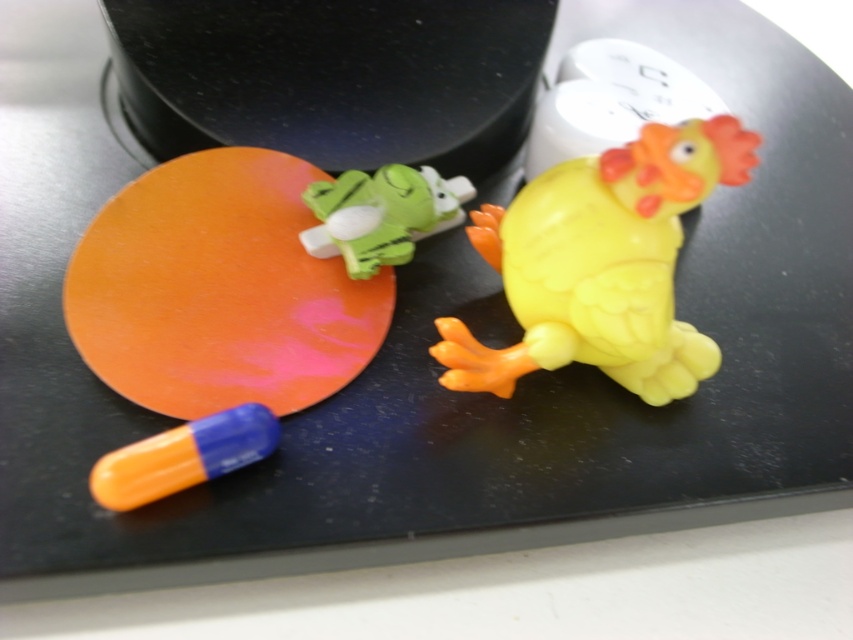
Between yellow rubber chicken at center and green rubber frog at center, which one has less height?

Standing shorter between the two is green rubber frog at center.

Who is lower down, yellow rubber chicken at center or green rubber frog at center?

yellow rubber chicken at center is below.

Between point (639, 368) and point (347, 253), which one is positioned in front?

Point (639, 368)

At what (x,y) coordinates should I click in order to perform the action: click on yellow rubber chicken at center. Please return your answer as a coordinate pair (x, y). Looking at the image, I should click on (601, 262).

Can you confirm if green rubber frog at center is positioned to the left of orange matte pill at lower left?

In fact, green rubber frog at center is to the right of orange matte pill at lower left.

This screenshot has width=853, height=640. Identify the location of green rubber frog at center. (381, 214).

Is point (345, 234) more distant than point (120, 448)?

Yes, point (345, 234) is farther from viewer.

At what (x,y) coordinates should I click in order to perform the action: click on green rubber frog at center. Please return your answer as a coordinate pair (x, y). The image size is (853, 640). Looking at the image, I should click on (381, 214).

Does yellow rubber chicken at center have a greater width compared to orange matte pill at lower left?

Yes.

Between yellow rubber chicken at center and orange matte pill at lower left, which one has less height?

With less height is orange matte pill at lower left.

Which is in front, point (689, 168) or point (144, 477)?

Point (144, 477) is more forward.

This screenshot has height=640, width=853. Find the location of `yellow rubber chicken at center`. yellow rubber chicken at center is located at coordinates (601, 262).